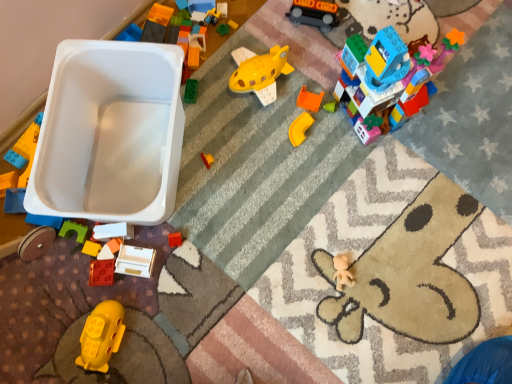
I want to click on vacant space to the right of white plastic toy car at upper left, so click(x=254, y=174).